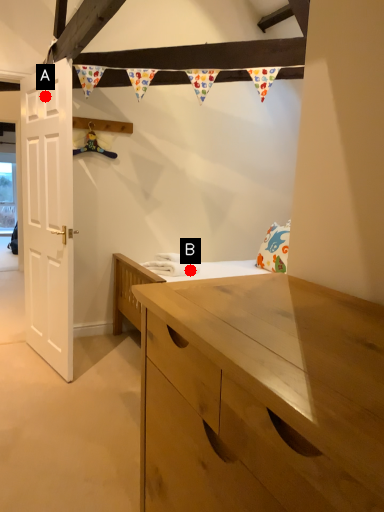
Question: Two points are circled on the image, labeled by A and B beside each circle. Which point is further to the camera?

Choices:
 (A) A is further
 (B) B is further

Answer: (B)